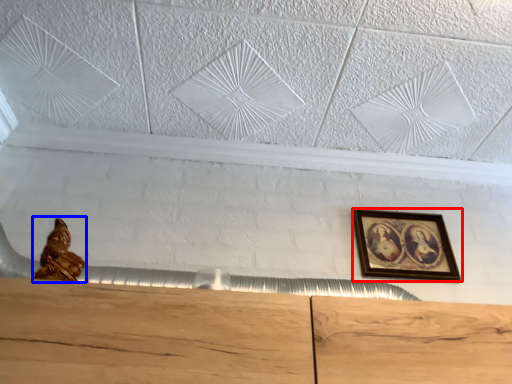
Question: Which of the following is the farthest to the observer, picture frame (highlighted by a red box) or sculpture (highlighted by a blue box)?

Choices:
 (A) picture frame
 (B) sculpture

Answer: (A)